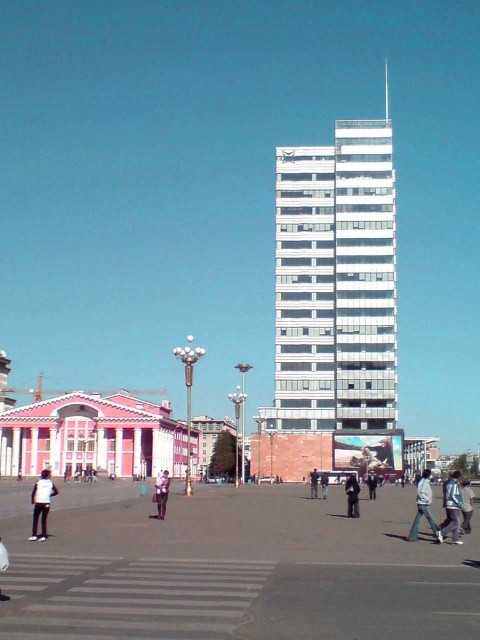
Question: Where is white glossy building at center located in relation to blue denim jeans at lower right in the image?

Choices:
 (A) below
 (B) above

Answer: (A)

Question: Can you confirm if blue denim jacket at lower right is wider than denim jacket at lower right?

Choices:
 (A) no
 (B) yes

Answer: (B)

Question: Which point appears farthest from the camera in this image?

Choices:
 (A) (347, 484)
 (B) (312, 472)
 (C) (326, 476)
 (D) (459, 483)

Answer: (C)

Question: Among these objects, which one is farthest from the camera?

Choices:
 (A) dark gray jacket at lower center
 (B) dark gray jacket at center
 (C) pink fabric bag at center
 (D) white smooth building at center

Answer: (D)

Question: Among these points, which one is farthest from the camera?

Choices:
 (A) (348, 477)
 (B) (158, 474)

Answer: (B)

Question: Is white matte jacket at lower left further to camera compared to pink fabric bag at center?

Choices:
 (A) no
 (B) yes

Answer: (A)